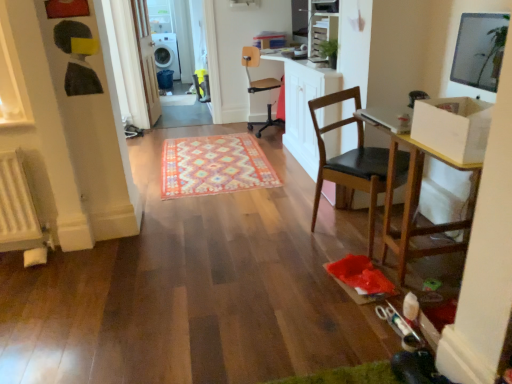
At what (x,y) coordinates should I click in order to perform the action: click on free region under black leather chair at center, marked as the 1th chair in a front-to-back arrangement (from a real-world perspective). Please return your answer as a coordinate pair (x, y). The image size is (512, 384). Looking at the image, I should click on (349, 223).